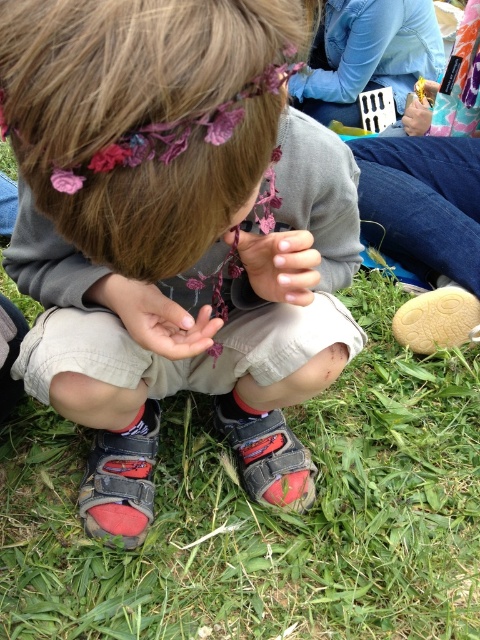
You are a shoe organizer trying to arrange the red rubber sandal at lower left and the tan suede sandal at lower right in a display. Which sandal should you place in the larger section of the display?

The red rubber sandal at lower left should be placed in the larger section of the display because it has a larger size compared to the tan suede sandal at lower right.

You are holding a small toy that is 10 inches long. If you want to place it on the ground in front of you so that it reaches the point marked as point (139, 205), will the toy extend beyond that point?

The distance of point (139, 205) from viewer is 19.18 inches. Since the toy is only 10 inches long, placing it towards the point would leave 9.18 inches remaining between the toy and the point. Therefore, the toy will not extend beyond the point.

You are standing in the scene and want to touch both the point at coordinates (445, 310) and the point at coordinates (424, 113). Which point will you reach first?

You will reach the point at coordinates (445, 310) first because it is closer to you than the point at coordinates (424, 113).